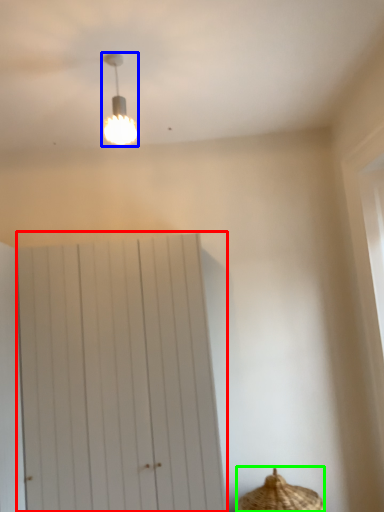
Question: Which object is the farthest from barn door (highlighted by a red box)? Choose among these: lamp (highlighted by a blue box) or basket (highlighted by a green box).

Choices:
 (A) lamp
 (B) basket

Answer: (A)